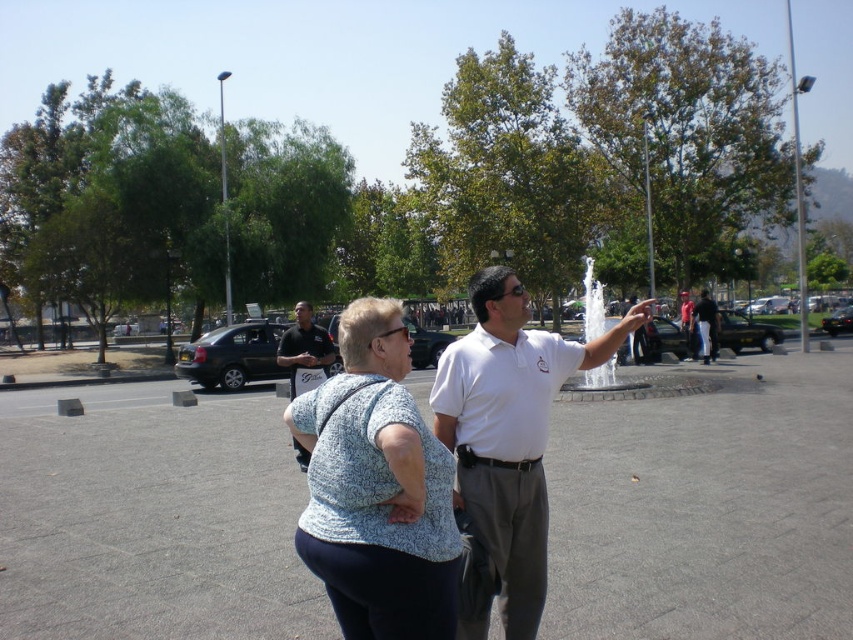
Can you confirm if light blue knit top at center is positioned above dark gray uniform at center?

No, light blue knit top at center is not above dark gray uniform at center.

Is light blue knit top at center smaller than dark gray uniform at center?

→ Indeed, light blue knit top at center has a smaller size compared to dark gray uniform at center.

The width and height of the screenshot is (853, 640). Identify the location of light blue knit top at center. (376, 488).

Which of these two, dark gray uniform at center or white shirt at center, stands shorter?

dark gray uniform at center

Identify the location of dark gray uniform at center. (305, 346).

Consider the image. Does white cotton shirt at center have a larger size compared to dark gray uniform at center?

No, white cotton shirt at center is not bigger than dark gray uniform at center.

In order to click on white cotton shirt at center in this screenshot , I will do `click(509, 429)`.

Identify the location of white cotton shirt at center. This screenshot has width=853, height=640. (509, 429).